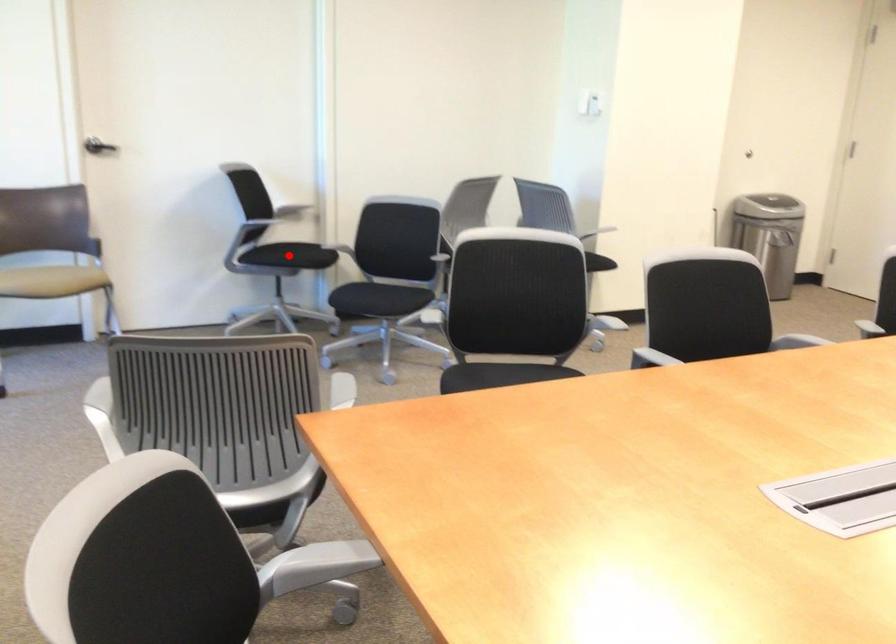
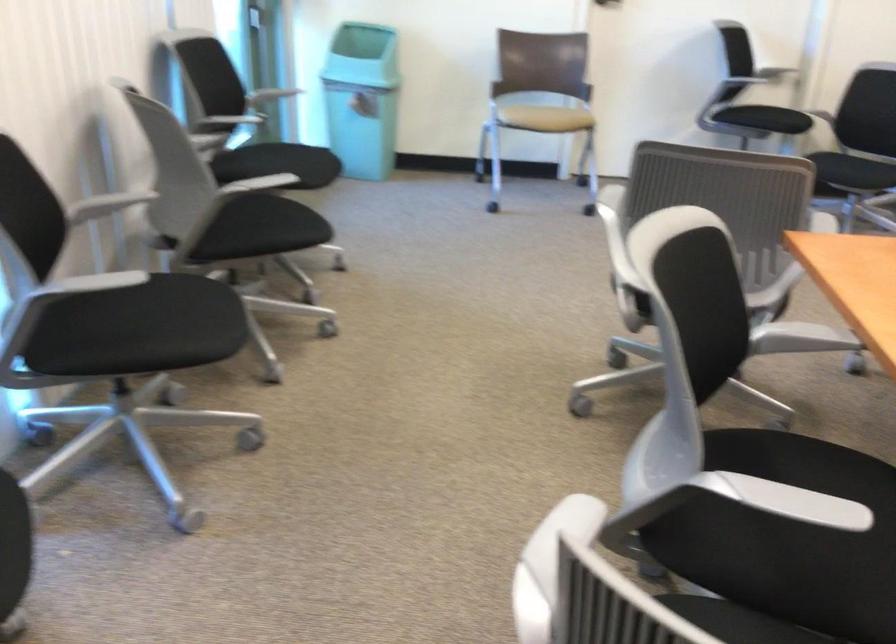
Question: I am providing you with two images of the same scene from different viewpoints. A red point is marked on the first image. Can you still see the location of the red point in image 2?

Choices:
 (A) Yes
 (B) No

Answer: (B)